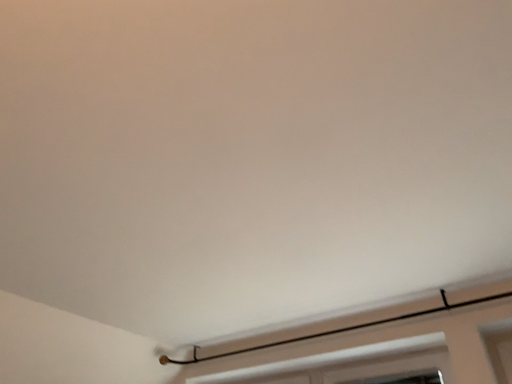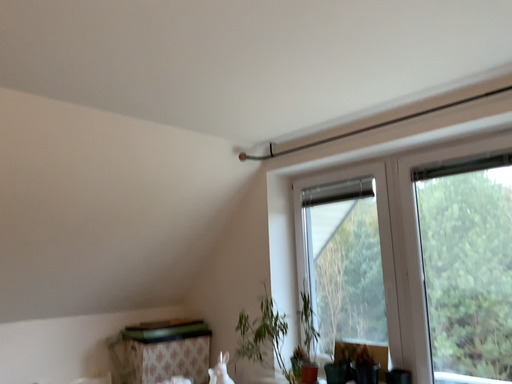
Question: Which way did the camera rotate in the video?

Choices:
 (A) rotated upward
 (B) rotated downward

Answer: (B)